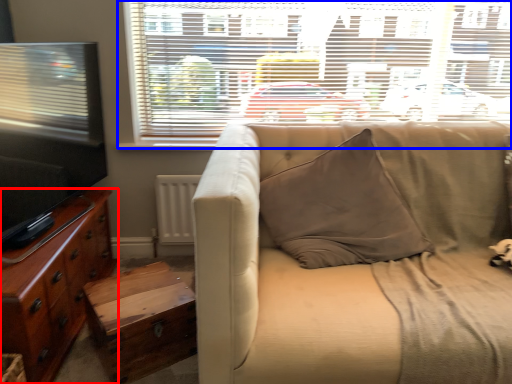
Question: Which object appears closest to the camera in this image, cabinetry (highlighted by a red box) or window (highlighted by a blue box)?

Choices:
 (A) cabinetry
 (B) window

Answer: (A)